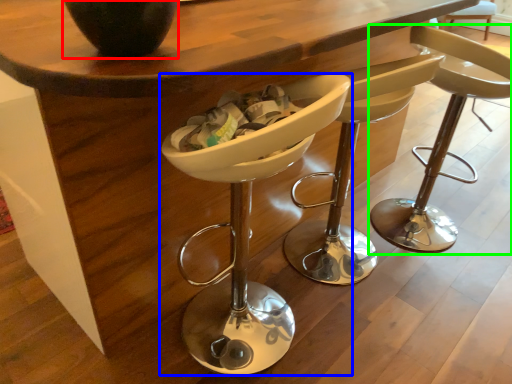
Question: Which object is the closest to the vase (highlighted by a red box)? Choose among these: chair (highlighted by a blue box) or chair (highlighted by a green box).

Choices:
 (A) chair
 (B) chair

Answer: (A)